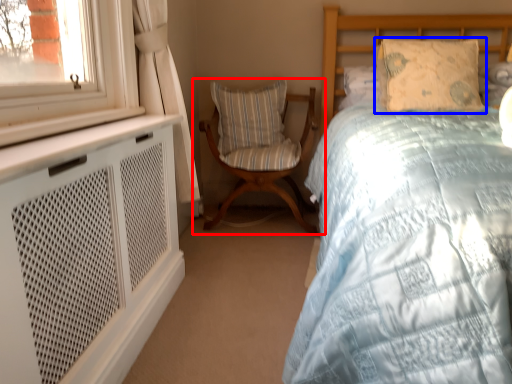
Question: Which of the following is the farthest to the observer, chair (highlighted by a red box) or pillow (highlighted by a blue box)?

Choices:
 (A) chair
 (B) pillow

Answer: (A)